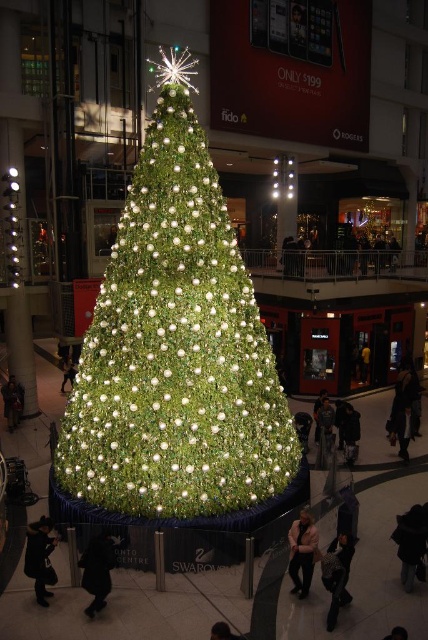
Does dark gray coat at lower left have a lesser width compared to dark gray sweater at center?

Yes.

Is dark gray coat at lower left bigger than dark gray sweater at center?

No.

Is point (44, 525) in front of point (336, 541)?

Yes, point (44, 525) is closer to viewer.

Image resolution: width=428 pixels, height=640 pixels. What are the coordinates of `dark gray coat at lower left` in the screenshot? It's located at (39, 557).

Which is in front, point (416, 532) or point (306, 536)?

Point (306, 536)

Between black fuzzy coat at lower right and light beige sweater at lower center, which one has less height?

With less height is light beige sweater at lower center.

The height and width of the screenshot is (640, 428). What do you see at coordinates (410, 541) in the screenshot? I see `black fuzzy coat at lower right` at bounding box center [410, 541].

Find the location of a particular element. The height and width of the screenshot is (640, 428). black fuzzy coat at lower right is located at coordinates (410, 541).

How much distance is there between dark gray coat at lower right and black fabric coat at lower left?

They are 36.44 feet apart.

Can you confirm if dark gray coat at lower right is wider than black fabric coat at lower left?

No.

Between point (401, 365) and point (89, 554), which one is positioned behind?

The point (401, 365) is more distant.

The width and height of the screenshot is (428, 640). Find the location of `dark gray coat at lower right`. dark gray coat at lower right is located at coordinates (404, 408).